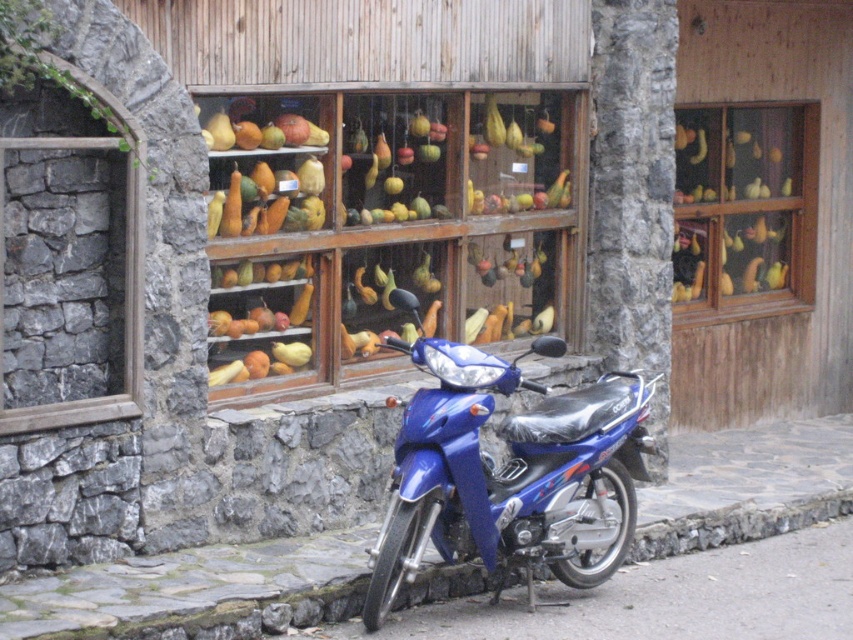
Can you confirm if blue glossy motorcycle at center is smaller than yellow/golden wood at center?

Yes, blue glossy motorcycle at center is smaller than yellow/golden wood at center.

Is blue glossy motorcycle at center taller than yellow/golden wood at center?

In fact, blue glossy motorcycle at center may be shorter than yellow/golden wood at center.

Who is more forward, (509, 467) or (808, 124)?

Point (509, 467)

Where is `blue glossy motorcycle at center`? This screenshot has width=853, height=640. blue glossy motorcycle at center is located at coordinates click(508, 474).

Does blue glossy motorcycle at center have a smaller size compared to gray stone curb at lower center?

Incorrect, blue glossy motorcycle at center is not smaller in size than gray stone curb at lower center.

Between blue glossy motorcycle at center and gray stone curb at lower center, which one is positioned higher?

blue glossy motorcycle at center

At what (x,y) coordinates should I click in order to perform the action: click on blue glossy motorcycle at center. Please return your answer as a coordinate pair (x, y). This screenshot has width=853, height=640. Looking at the image, I should click on (508, 474).

The image size is (853, 640). I want to click on blue glossy motorcycle at center, so click(x=508, y=474).

Between wooden shelves at center and blue glossy motorcycle at center, which one is positioned higher?

wooden shelves at center is above.

Does wooden shelves at center lie behind blue glossy motorcycle at center?

Yes, it is.

Identify the location of wooden shelves at center. (381, 225).